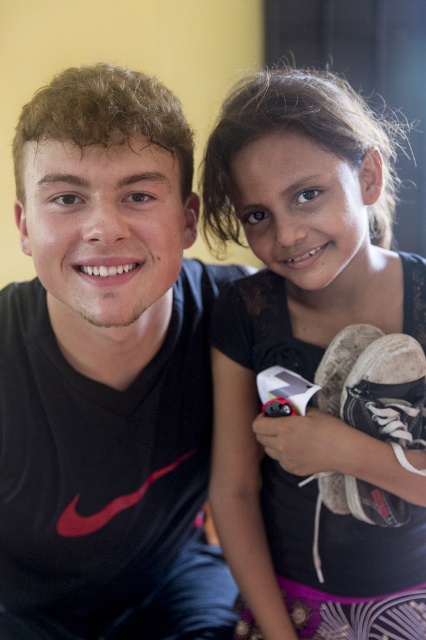
Is black matte shirt at left to the left of matte black dress at upper right from the viewer's perspective?

Indeed, black matte shirt at left is positioned on the left side of matte black dress at upper right.

From the picture: Does black matte shirt at left have a greater height compared to matte black dress at upper right?

Correct, black matte shirt at left is much taller as matte black dress at upper right.

Between point (80, 348) and point (256, 608), which one is positioned behind?

The point (256, 608) is behind.

Find the location of `black matte shirt at left`. black matte shirt at left is located at coordinates (108, 372).